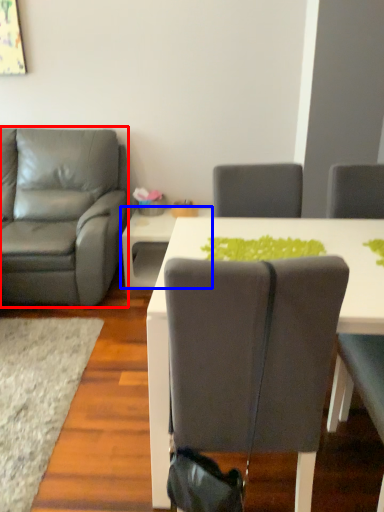
Question: Which point is closer to the camera, chair (highlighted by a red box) or table (highlighted by a blue box)?

Choices:
 (A) chair
 (B) table

Answer: (A)